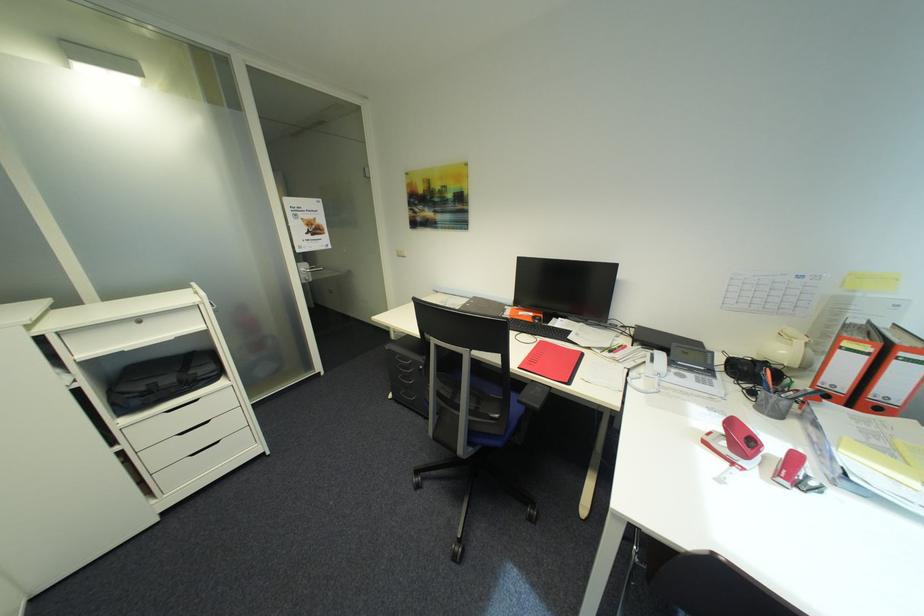
Identify the location of blue chair sitting surface. This screenshot has height=616, width=924. (473, 400).